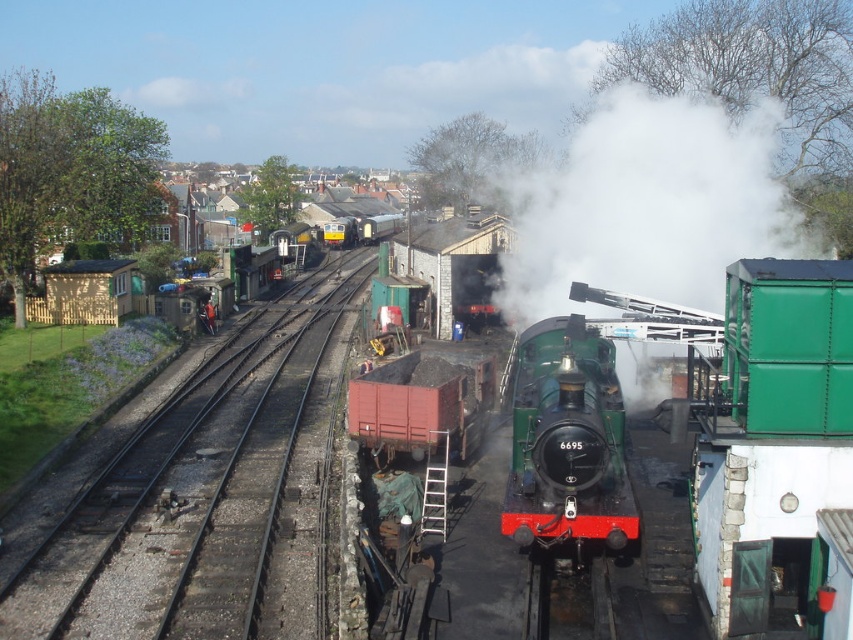
Is black metal train track at center bigger than white matte steam at center?

No.

Is point (230, 497) closer to camera compared to point (628, 291)?

Yes, point (230, 497) is closer to viewer.

You are a GUI agent. You are given a task and a screenshot of the screen. Output one action in this format:
    pyautogui.click(x=<x>, y=<y>)
    Task: Click on the black metal train track at center
    
    Given the screenshot: What is the action you would take?
    pyautogui.click(x=210, y=490)

Between black metal train track at center and green polished wood steam engine at center, which one has more height?

Standing taller between the two is black metal train track at center.

Locate an element on the screen. The height and width of the screenshot is (640, 853). black metal train track at center is located at coordinates (210, 490).

Is point (177, 388) closer to camera compared to point (523, 451)?

That is False.

Image resolution: width=853 pixels, height=640 pixels. What are the coordinates of `black metal train track at center` in the screenshot? It's located at (210, 490).

Between green polished wood steam engine at center and rusty metal coal car at center, which one appears on the left side from the viewer's perspective?

rusty metal coal car at center

Is the position of green polished wood steam engine at center more distant than that of rusty metal coal car at center?

No, it is in front of rusty metal coal car at center.

I want to click on green polished wood steam engine at center, so click(567, 440).